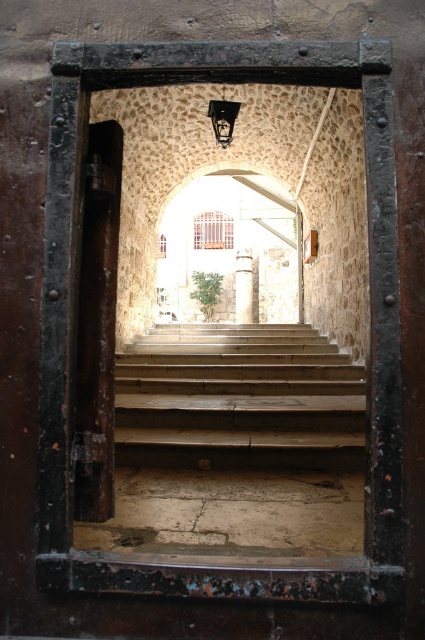
Question: Is wooden stairs at center smaller than rusty metal door at left?

Choices:
 (A) no
 (B) yes

Answer: (A)

Question: Which of the following is the farthest from the observer?

Choices:
 (A) (102, 150)
 (B) (186, 362)

Answer: (B)

Question: Is the position of wooden stairs at center less distant than that of rusty metal door at left?

Choices:
 (A) yes
 (B) no

Answer: (B)

Question: In this image, where is wooden stairs at center located relative to rusty metal door at left?

Choices:
 (A) above
 (B) below

Answer: (B)

Question: Which object appears closest to the camera in this image?

Choices:
 (A) rusty metal door at left
 (B) wooden stairs at center

Answer: (A)

Question: Which of the following is the farthest from the observer?

Choices:
 (A) pos(158,460)
 (B) pos(113,230)

Answer: (A)